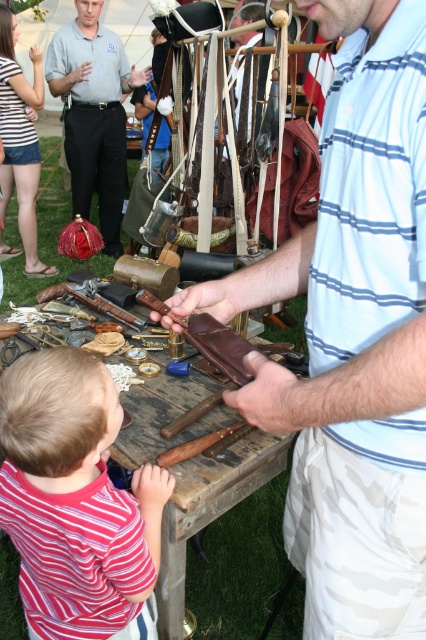
Question: Can you confirm if wooden table at center is smaller than matte black shirt at upper left?

Choices:
 (A) yes
 (B) no

Answer: (A)

Question: Where is wooden table at center located in relation to matte black shirt at upper left in the image?

Choices:
 (A) left
 (B) right

Answer: (B)

Question: Which point is farther to the camera?

Choices:
 (A) wooden table at center
 (B) matte black shirt at upper left
 (C) light blue striped shirt at center

Answer: (B)

Question: Which is nearer to the matte black shirt at upper left?

Choices:
 (A) striped shirt at lower left
 (B) light blue striped shirt at center

Answer: (A)

Question: Is the position of light blue striped shirt at center more distant than that of matte black shirt at upper left?

Choices:
 (A) yes
 (B) no

Answer: (B)

Question: Which of these objects is positioned closest to the light blue striped shirt at center?

Choices:
 (A) striped shirt at lower left
 (B) wooden table at center

Answer: (A)